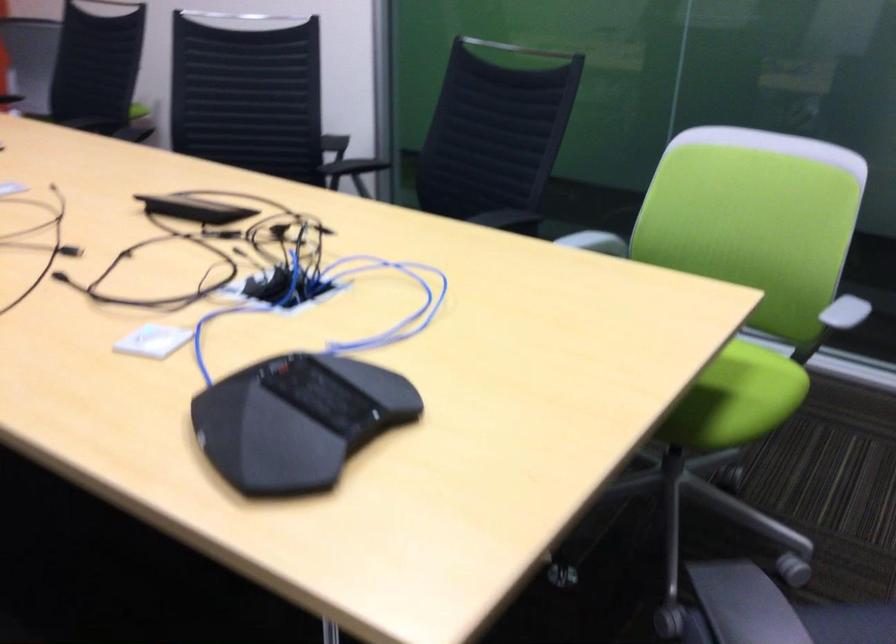
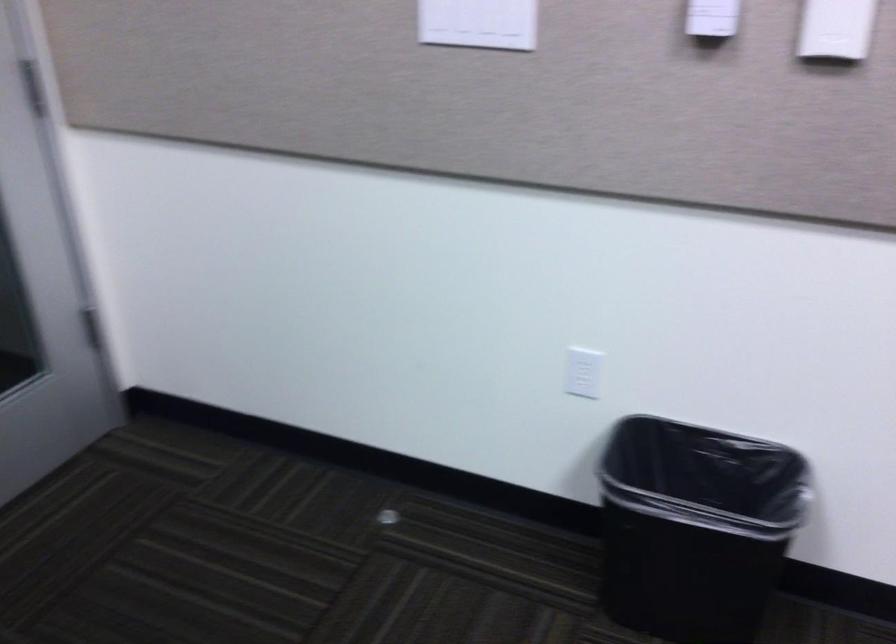
First-person continuous shooting, in which direction is the camera rotating?

The camera rotated toward right-down.